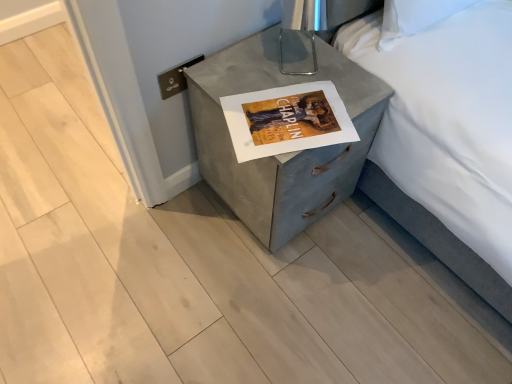
The width and height of the screenshot is (512, 384). In order to click on free spot in front of concrete side table at center in this screenshot , I will do `click(274, 291)`.